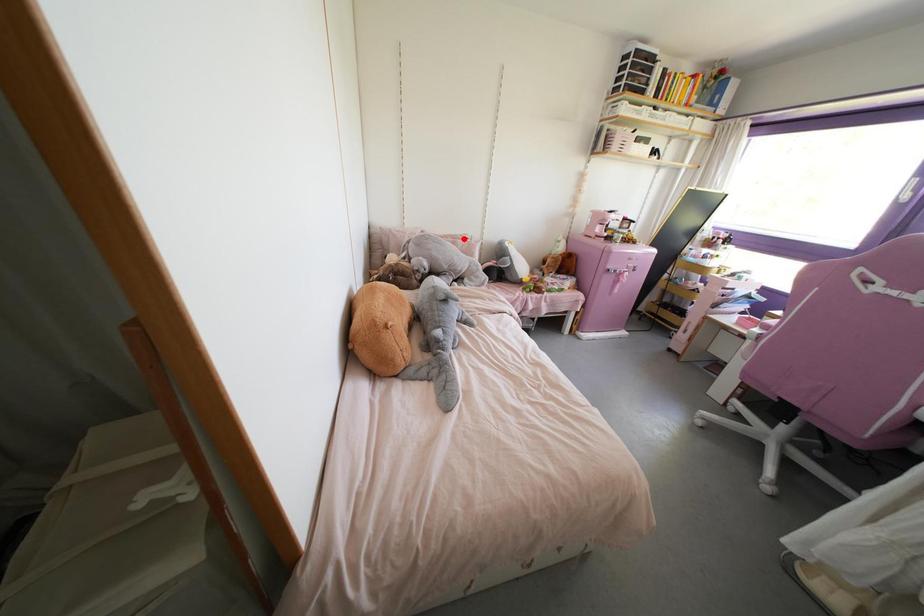
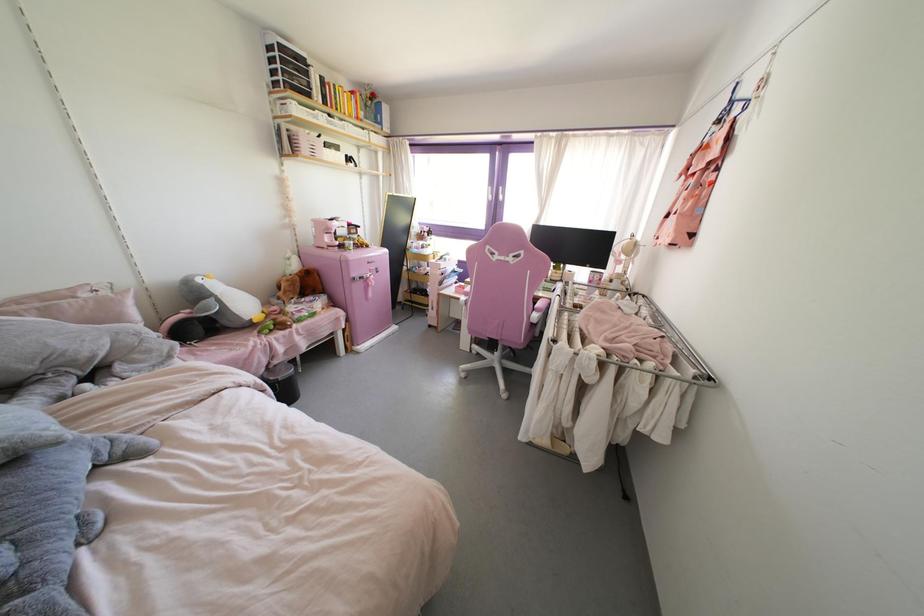
The point at the highlighted location is marked in the first image. Where is the corresponding point in the second image?

(83, 294)